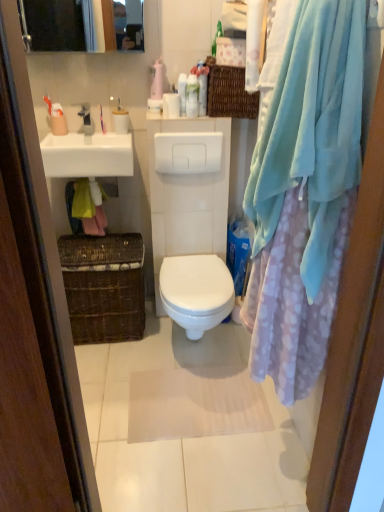
Locate an element on the screen. This screenshot has height=512, width=384. free space on the front side of white textured bath mat at center is located at coordinates pyautogui.click(x=202, y=469).